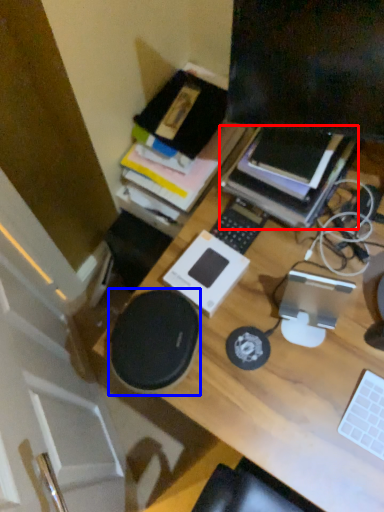
Question: Which object is further to the camera taking this photo, paperback book (highlighted by a red box) or speaker (highlighted by a blue box)?

Choices:
 (A) paperback book
 (B) speaker

Answer: (A)